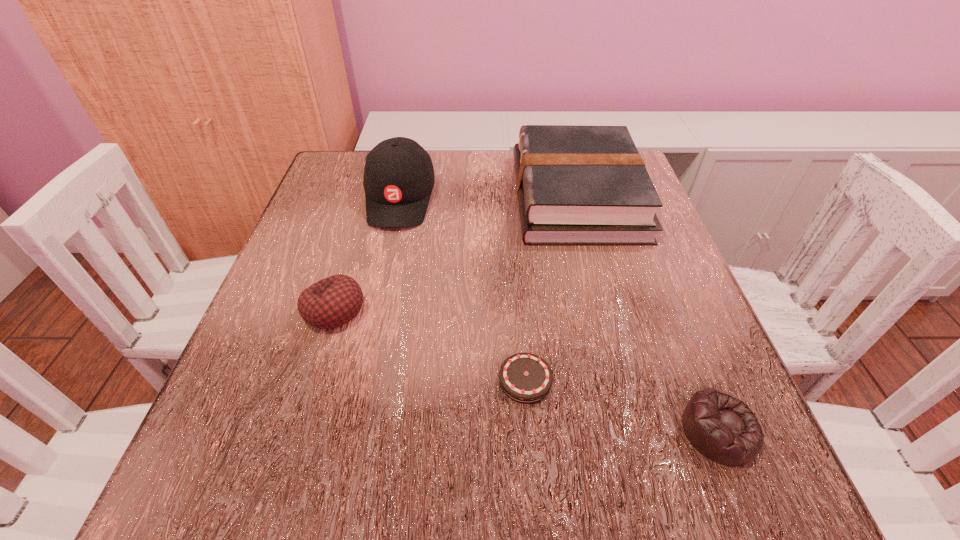
At what (x,y) coordinates should I click in order to perform the action: click on the tallest object. Please return your answer as a coordinate pair (x, y). The width and height of the screenshot is (960, 540). Looking at the image, I should click on (398, 180).

Locate an element on the screen. The height and width of the screenshot is (540, 960). the fourth shortest object is located at coordinates (576, 185).

Identify the location of the farther beanbag. Image resolution: width=960 pixels, height=540 pixels. (333, 301).

You are a GUI agent. You are given a task and a screenshot of the screen. Output one action in this format:
    pyautogui.click(x=<x>, y=<y>)
    Task: Click on the taller beanbag
    This screenshot has height=540, width=960.
    Given the screenshot: What is the action you would take?
    pyautogui.click(x=333, y=301)

The image size is (960, 540). I want to click on the second shortest object, so click(722, 428).

Locate an element on the screen. This screenshot has width=960, height=540. the nearer beanbag is located at coordinates (722, 428).

Where is `the shortest object`? the shortest object is located at coordinates (526, 378).

Locate an element on the screen. vacant space located 0.080m with a logo on the front of the baseball cap is located at coordinates (387, 259).

This screenshot has height=540, width=960. I want to click on vacant point located 0.150m on the spine side of the second tallest object, so click(449, 197).

At what (x,y) coordinates should I click in order to perform the action: click on vacant area located on the spine side of the second tallest object. Please return your answer as a coordinate pair (x, y). Looking at the image, I should click on (427, 197).